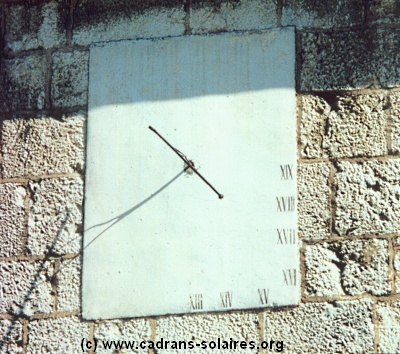
This screenshot has width=400, height=354. In order to click on white clock in this screenshot , I will do `click(206, 146)`.